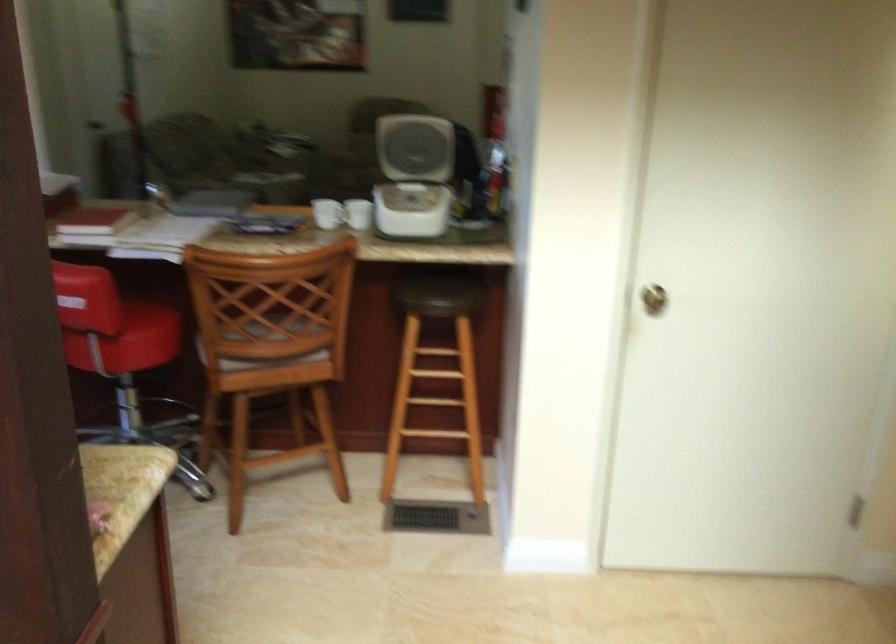
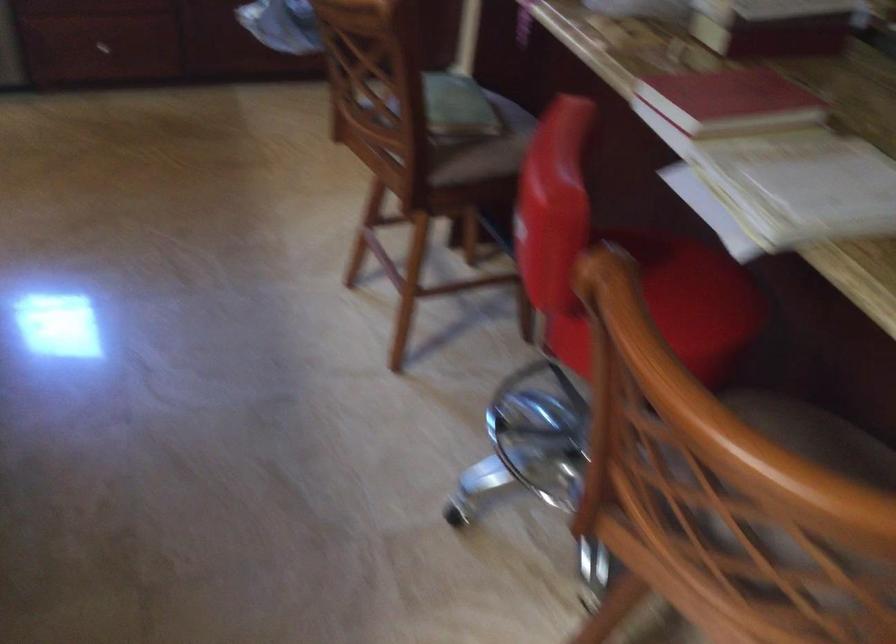
In the second image, find the point that corresponds to the point at 112,214 in the first image.

(729, 100)